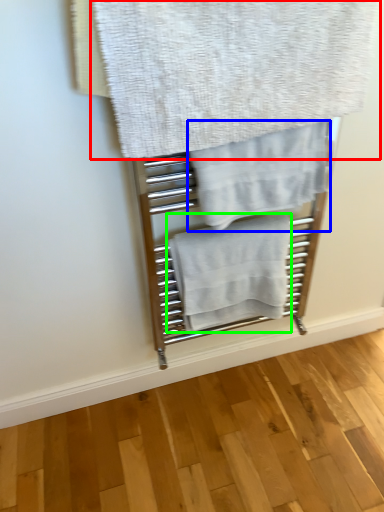
Question: Estimate the real-world distances between objects in this image. Which object is farther from towel (highlighted by a red box), towel (highlighted by a blue box) or towel (highlighted by a green box)?

Choices:
 (A) towel
 (B) towel

Answer: (B)